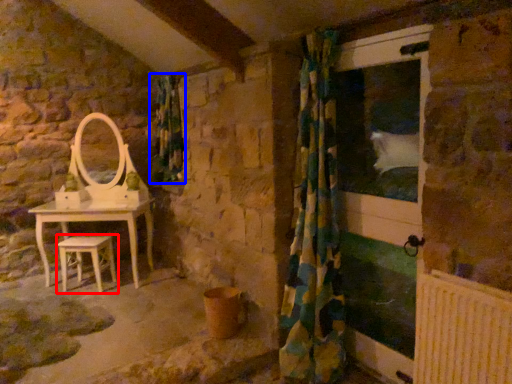
Question: Which point is closer to the camera, stool (highlighted by a red box) or shower curtain (highlighted by a blue box)?

Choices:
 (A) stool
 (B) shower curtain

Answer: (A)